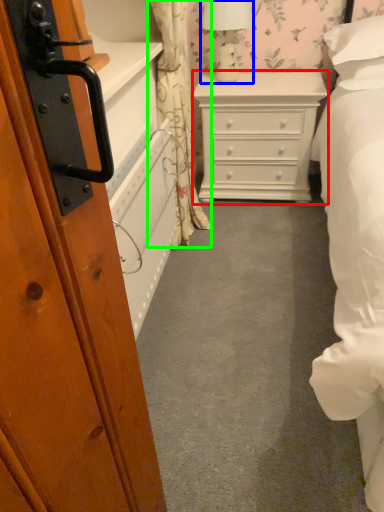
Question: Considering the real-world distances, which object is closest to chest of drawers (highlighted by a red box)? table lamp (highlighted by a blue box) or curtain (highlighted by a green box).

Choices:
 (A) table lamp
 (B) curtain

Answer: (A)